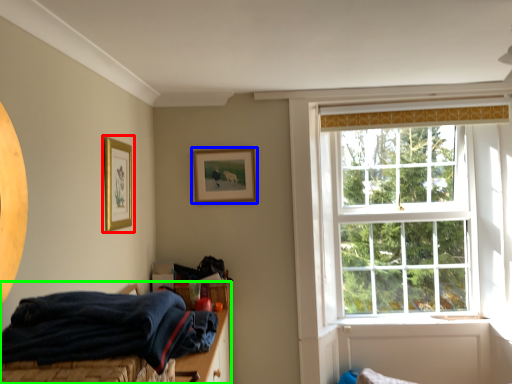
Question: Estimate the real-world distances between objects in this image. Which object is closer to picture frame (highlighted by a red box), picture frame (highlighted by a blue box) or bed (highlighted by a green box)?

Choices:
 (A) picture frame
 (B) bed

Answer: (A)